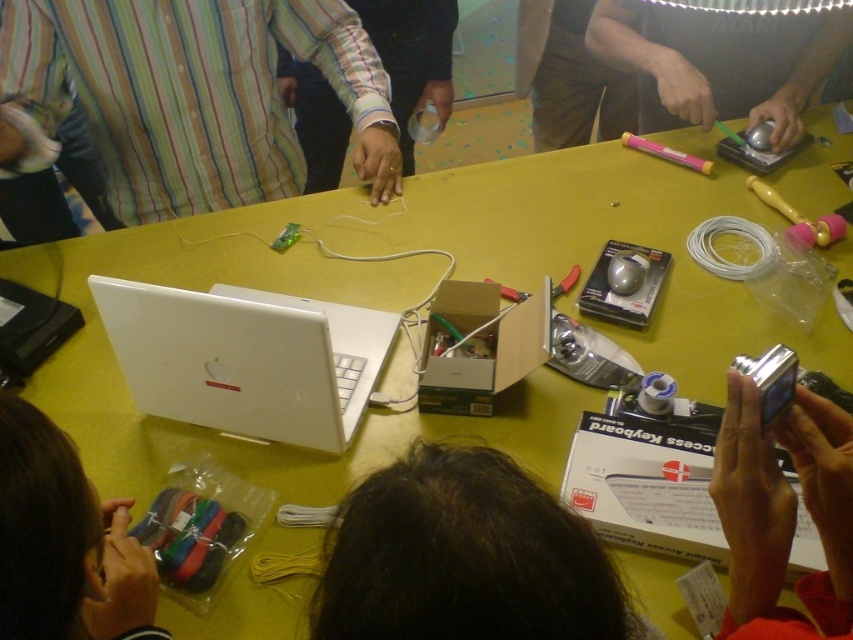
Question: Among these objects, which one is nearest to the camera?

Choices:
 (A) metallic silver mouse at upper right
 (B) metallic silver camera at lower right

Answer: (B)

Question: Does metallic silver camera at lower right appear under yellow rubber duster at upper right?

Choices:
 (A) no
 (B) yes

Answer: (B)

Question: Which of the following is the farthest from the observer?

Choices:
 (A) (782, 216)
 (B) (750, 500)

Answer: (A)

Question: Estimate the real-world distances between objects in this image. Which object is closer to the white matte laptop at center?

Choices:
 (A) yellow rubber duster at upper right
 (B) silver metallic camera at lower right
 (C) matte white laptop at lower left
 (D) metallic silver mouse at center

Answer: (C)

Question: Is dark brown hair at center behind metallic silver mouse at center?

Choices:
 (A) no
 (B) yes

Answer: (A)

Question: Is matte white laptop at lower left positioned in front of silver metallic camera at lower right?

Choices:
 (A) yes
 (B) no

Answer: (A)